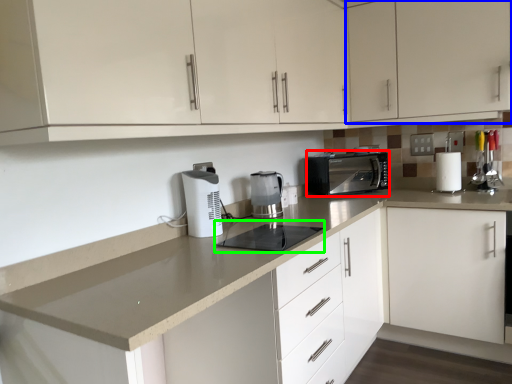
Question: Which is nearer to the kitchen appliance (highlighted by a red box)? cabinetry (highlighted by a blue box) or appliance (highlighted by a green box).

Choices:
 (A) cabinetry
 (B) appliance

Answer: (A)